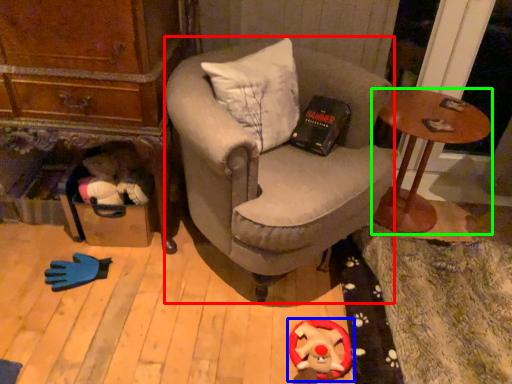
Question: Which object is positioned farthest from chair (highlighted by a red box)? Select from toy (highlighted by a blue box) and desk (highlighted by a green box).

Choices:
 (A) toy
 (B) desk

Answer: (A)